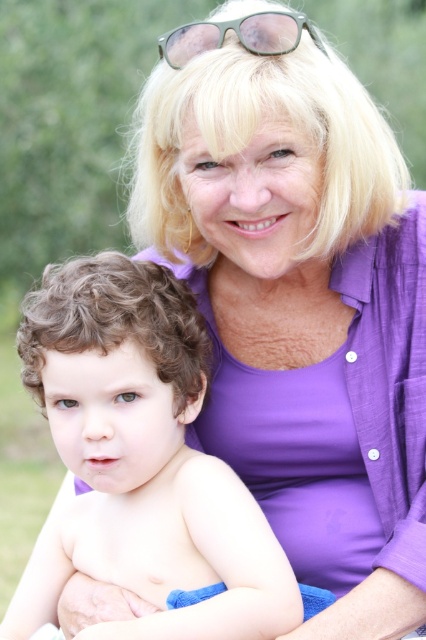
Is curly hair at center taller than green matte sunglasses at upper center?

Indeed, curly hair at center has a greater height compared to green matte sunglasses at upper center.

Where is `curly hair at center`? The height and width of the screenshot is (640, 426). curly hair at center is located at coordinates (141, 460).